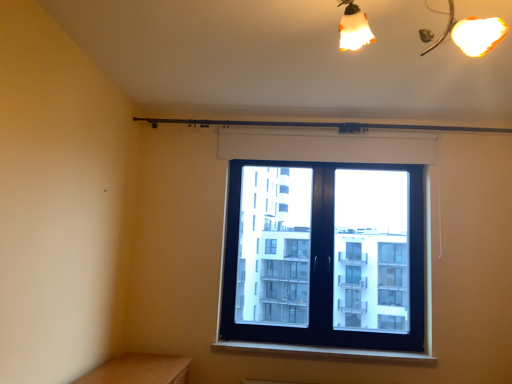
Locate an element on the screen. The width and height of the screenshot is (512, 384). black plastic window at center is located at coordinates (326, 146).

Describe the element at coordinates (326, 146) in the screenshot. I see `black plastic window at center` at that location.

Where is `white matte shutter at upper center`? white matte shutter at upper center is located at coordinates (326, 146).

Considering the relative sizes of black plastic window at center and white plastic window sill at lower center in the image provided, is black plastic window at center taller than white plastic window sill at lower center?

Correct, black plastic window at center is much taller as white plastic window sill at lower center.

In terms of width, does black plastic window at center look wider or thinner when compared to white plastic window sill at lower center?

black plastic window at center is thinner than white plastic window sill at lower center.

Locate an element on the screen. This screenshot has width=512, height=384. window sill below the black plastic window at center (from a real-world perspective) is located at coordinates (323, 352).

From a real-world perspective, who is located higher, white matte shutter at upper center or white plastic window sill at lower center?

white matte shutter at upper center, from a real-world perspective.

Based on the photo, looking at their sizes, would you say white matte shutter at upper center is wider or thinner than white plastic window sill at lower center?

Clearly, white matte shutter at upper center has less width compared to white plastic window sill at lower center.

Between white matte shutter at upper center and white plastic window sill at lower center, which one has larger size?

white plastic window sill at lower center.

How distant is white matte shutter at upper center from white plastic window sill at lower center?

white matte shutter at upper center is 4.64 feet from white plastic window sill at lower center.

From a real-world perspective, which is physically above, white matte shutter at upper center or black plastic window at center?

From a 3D spatial view, white matte shutter at upper center is above.

Is white matte shutter at upper center positioned beyond the bounds of black plastic window at center?

Absolutely, white matte shutter at upper center is external to black plastic window at center.

In the scene shown: Does white matte shutter at upper center have a lesser height compared to black plastic window at center?

Yes, white matte shutter at upper center is shorter than black plastic window at center.

How different are the orientations of white matte shutter at upper center and black plastic window at center in degrees?

0.000779 degrees separate the facing orientations of white matte shutter at upper center and black plastic window at center.

Based on the photo, considering the relative sizes of black plastic window at center and white matte shutter at upper center in the image provided, is black plastic window at center wider than white matte shutter at upper center?

Yes, black plastic window at center is wider than white matte shutter at upper center.

Is black plastic window at center situated inside white matte shutter at upper center or outside?

black plastic window at center is not enclosed by white matte shutter at upper center.

Considering the sizes of objects black plastic window at center and white matte shutter at upper center in the image provided, who is taller, black plastic window at center or white matte shutter at upper center?

black plastic window at center.

Is white plastic window sill at lower center spatially inside black plastic window at center, or outside of it?

white plastic window sill at lower center is outside black plastic window at center.

Can you confirm if white plastic window sill at lower center is shorter than black plastic window at center?

Yes.

I want to click on window sill located underneath the black plastic window at center (from a real-world perspective), so click(x=323, y=352).

Is white plastic window sill at lower center aimed at black plastic window at center?

No, white plastic window sill at lower center does not turn towards black plastic window at center.

From the image's perspective, is white plastic window sill at lower center beneath white matte shutter at upper center?

Yes.

From their relative heights in the image, would you say white plastic window sill at lower center is taller or shorter than white matte shutter at upper center?

white plastic window sill at lower center is shorter than white matte shutter at upper center.

Which object is positioned more to the left, white plastic window sill at lower center or white matte shutter at upper center?

Positioned to the left is white plastic window sill at lower center.

Which object is closer to the camera taking this photo, white plastic window sill at lower center or white matte shutter at upper center?

white plastic window sill at lower center.

Identify the location of window on the right of white plastic window sill at lower center. The width and height of the screenshot is (512, 384). (326, 146).

At what (x,y) coordinates should I click in order to perform the action: click on window sill that appears in front of the white matte shutter at upper center. Please return your answer as a coordinate pair (x, y). Looking at the image, I should click on (323, 352).

Estimate the real-world distances between objects in this image. Which object is further from white plastic window sill at lower center, black plastic window at center or white matte shutter at upper center?

white matte shutter at upper center is positioned further to the anchor white plastic window sill at lower center.

When comparing their distances from black plastic window at center, does white plastic window sill at lower center or white matte shutter at upper center seem further?

white plastic window sill at lower center is further to black plastic window at center.

Considering their positions, is white plastic window sill at lower center positioned closer to white matte shutter at upper center than black plastic window at center?

black plastic window at center is closer to white matte shutter at upper center.

Looking at the image, which one is located closer to black plastic window at center, white matte shutter at upper center or white plastic window sill at lower center?

white matte shutter at upper center is closer to black plastic window at center.

Considering their positions, is black plastic window at center positioned closer to white matte shutter at upper center than white plastic window sill at lower center?

Among the two, black plastic window at center is located nearer to white matte shutter at upper center.

Which object lies further to the anchor point white plastic window sill at lower center, white matte shutter at upper center or black plastic window at center?

white matte shutter at upper center is positioned further to the anchor white plastic window sill at lower center.

Identify the location of window between white matte shutter at upper center and white plastic window sill at lower center vertically. The width and height of the screenshot is (512, 384). (326, 146).